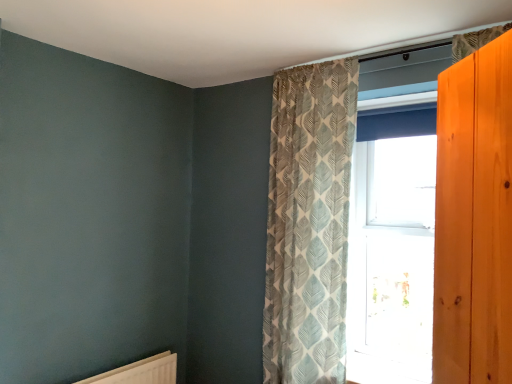
Where is `textured beige curtain at upper center`? textured beige curtain at upper center is located at coordinates (309, 223).

Considering the sizes of objects clear glass window at center and white matte radiator at lower left in the image provided, who is shorter, clear glass window at center or white matte radiator at lower left?

white matte radiator at lower left.

Is clear glass window at center thinner than white matte radiator at lower left?

No, clear glass window at center is not thinner than white matte radiator at lower left.

From the image's perspective, which object appears higher, clear glass window at center or white matte radiator at lower left?

clear glass window at center appears higher in the image.

Are white matte radiator at lower left and clear glass window at center located far from each other?

white matte radiator at lower left is far away from clear glass window at center.

Locate an element on the screen. This screenshot has width=512, height=384. radiator in front of the clear glass window at center is located at coordinates (140, 372).

From the image's perspective, between white matte radiator at lower left and clear glass window at center, who is located below?

white matte radiator at lower left, from the image's perspective.

Could you tell me if white matte radiator at lower left is turned towards clear glass window at center?

No, white matte radiator at lower left is not aimed at clear glass window at center.

In the image, is clear glass window at center positioned in front of or behind textured beige curtain at upper center?

In the image, clear glass window at center appears behind textured beige curtain at upper center.

Is clear glass window at center positioned far away from textured beige curtain at upper center?

No, clear glass window at center is not far from textured beige curtain at upper center.

Considering the positions of points (402, 343) and (289, 151), is point (402, 343) closer to camera compared to point (289, 151)?

No, (402, 343) is behind (289, 151).

From a real-world perspective, is clear glass window at center beneath textured beige curtain at upper center?

Incorrect, from a real-world perspective, clear glass window at center is higher than textured beige curtain at upper center.

Is textured beige curtain at upper center at the left side of white matte radiator at lower left?

Incorrect, textured beige curtain at upper center is not on the left side of white matte radiator at lower left.

Is textured beige curtain at upper center turned away from white matte radiator at lower left?

textured beige curtain at upper center does not have its back to white matte radiator at lower left.

From the picture: Which of these two, textured beige curtain at upper center or white matte radiator at lower left, is smaller?

white matte radiator at lower left.

Considering the positions of point (89, 383) and point (345, 153), is point (89, 383) closer or farther from the camera than point (345, 153)?

Point (89, 383) is positioned farther from the camera compared to point (345, 153).

Is white matte radiator at lower left at the right side of textured beige curtain at upper center?

No, white matte radiator at lower left is not to the right of textured beige curtain at upper center.

How different are the orientations of white matte radiator at lower left and textured beige curtain at upper center in degrees?

87.4 degrees separate the facing orientations of white matte radiator at lower left and textured beige curtain at upper center.

Is white matte radiator at lower left positioned with its back to textured beige curtain at upper center?

No, white matte radiator at lower left's orientation is not away from textured beige curtain at upper center.

Is textured beige curtain at upper center turned away from clear glass window at center?

Absolutely, textured beige curtain at upper center is directed away from clear glass window at center.

Are textured beige curtain at upper center and clear glass window at center far apart?

No, textured beige curtain at upper center is not far away from clear glass window at center.

Considering the sizes of textured beige curtain at upper center and clear glass window at center in the image, is textured beige curtain at upper center bigger or smaller than clear glass window at center?

In the image, textured beige curtain at upper center appears to be larger than clear glass window at center.

Considering the points (341, 256) and (382, 217), which point is in front, point (341, 256) or point (382, 217)?

Positioned in front is point (341, 256).

Locate an element on the screen. radiator below the clear glass window at center (from a real-world perspective) is located at coordinates (140, 372).

I want to click on window behind the white matte radiator at lower left, so click(392, 247).

When comparing their distances from textured beige curtain at upper center, does clear glass window at center or white matte radiator at lower left seem further?

white matte radiator at lower left.

Consider the image. Looking at the image, which one is located further to white matte radiator at lower left, textured beige curtain at upper center or clear glass window at center?

clear glass window at center is positioned further to the anchor white matte radiator at lower left.

Based on their spatial positions, is white matte radiator at lower left or textured beige curtain at upper center further from clear glass window at center?

white matte radiator at lower left is further to clear glass window at center.

Looking at this image, estimate the real-world distances between objects in this image. Which object is closer to clear glass window at center, textured beige curtain at upper center or white matte radiator at lower left?

textured beige curtain at upper center is positioned closer to the anchor clear glass window at center.

From the picture: When comparing their distances from textured beige curtain at upper center, does white matte radiator at lower left or clear glass window at center seem further?

white matte radiator at lower left is positioned further to the anchor textured beige curtain at upper center.

From the image, which object appears to be farther from white matte radiator at lower left, clear glass window at center or textured beige curtain at upper center?

Based on the image, clear glass window at center appears to be further to white matte radiator at lower left.

The height and width of the screenshot is (384, 512). In order to click on curtain between white matte radiator at lower left and clear glass window at center from left to right in this screenshot , I will do `click(309, 223)`.